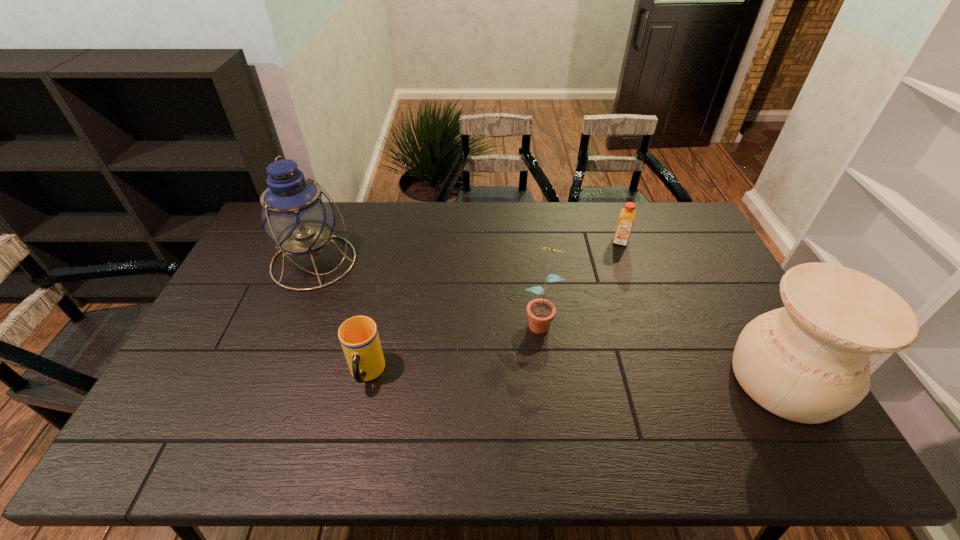
You are a GUI agent. You are given a task and a screenshot of the screen. Output one action in this format:
    pyautogui.click(x=<x>, y=<y>)
    Task: Click on the free space on the desktop that is between the cup and the pottery and is positioned on the front and back of the fourth object from left to right
    
    Given the screenshot: What is the action you would take?
    pyautogui.click(x=603, y=377)

This screenshot has height=540, width=960. Identify the location of vacant spot on the desktop that is between the cup and the rightmost object and is positioned on the front-facing side of the lantern. (517, 376).

You are a GUI agent. You are given a task and a screenshot of the screen. Output one action in this format:
    pyautogui.click(x=<x>, y=<y>)
    Task: Click on the free space on the desktop that is between the cup and the rightmost object and is positioned on the flower of the sunflower
    
    Given the screenshot: What is the action you would take?
    pyautogui.click(x=524, y=376)